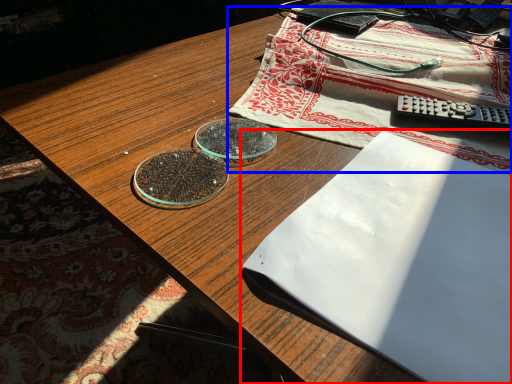
Question: Which point is closer to the camera, notebook (highlighted by a red box) or tablecloth (highlighted by a blue box)?

Choices:
 (A) notebook
 (B) tablecloth

Answer: (A)